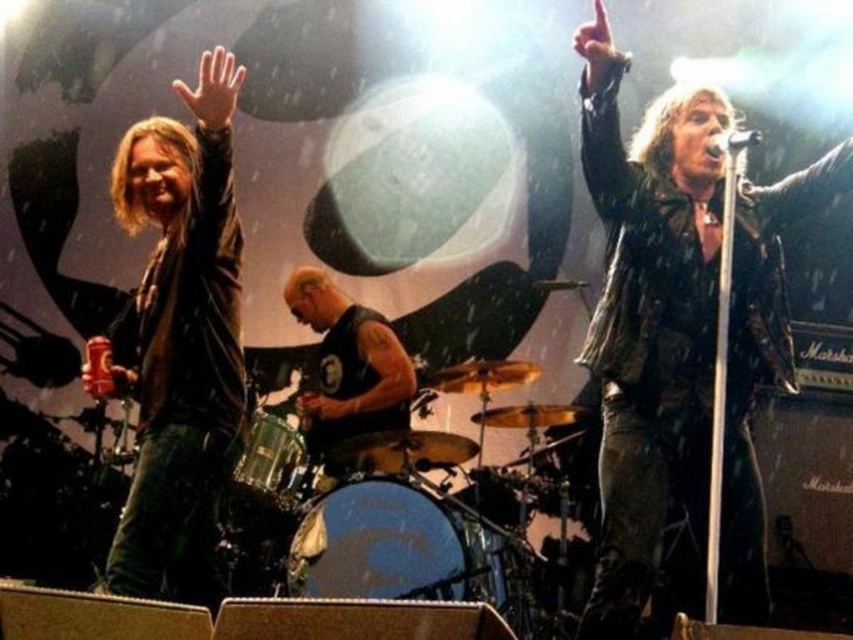
Which is in front, point (229, 252) or point (247, 451)?

Point (229, 252) is more forward.

Can you confirm if matte black leather jacket at left is taller than shiny metallic drum at center?

Correct, matte black leather jacket at left is much taller as shiny metallic drum at center.

Is point (160, 230) closer to viewer compared to point (276, 417)?

That is False.

At what (x,y) coordinates should I click in order to perform the action: click on matte black leather jacket at left. Please return your answer as a coordinate pair (x, y). Looking at the image, I should click on (178, 337).

Based on the photo, can you confirm if black leather vest at center is taller than shiny metallic drum at center?

Yes.

Does point (358, 384) lie behind point (270, 477)?

Yes, it is.

Find the location of `black leather vest at center`. black leather vest at center is located at coordinates (347, 364).

Does shiny black leather jacket at upper right appear under blue drumhead at center?

No, shiny black leather jacket at upper right is not below blue drumhead at center.

Image resolution: width=853 pixels, height=640 pixels. In order to click on shiny black leather jacket at upper right in this screenshot , I will do `click(650, 333)`.

Is point (614, 349) less distant than point (483, 536)?

Yes, it is.

The width and height of the screenshot is (853, 640). Identify the location of shiny black leather jacket at upper right. (650, 333).